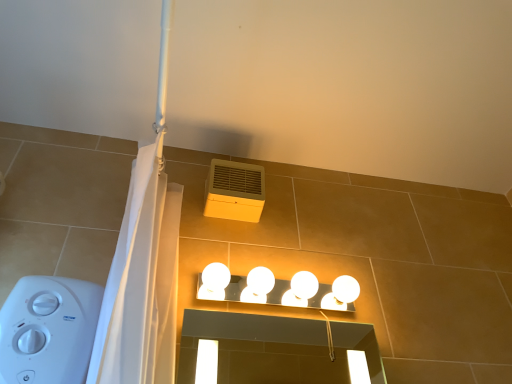
Locate an element on the screen. The height and width of the screenshot is (384, 512). white glossy light fixture at upper center is located at coordinates (281, 289).

What do you see at coordinates (281, 289) in the screenshot? The width and height of the screenshot is (512, 384). I see `white glossy light fixture at upper center` at bounding box center [281, 289].

This screenshot has height=384, width=512. Find the location of `yellow matte air conditioning at upper center`. yellow matte air conditioning at upper center is located at coordinates (234, 191).

This screenshot has height=384, width=512. Describe the element at coordinates (234, 191) in the screenshot. I see `yellow matte air conditioning at upper center` at that location.

I want to click on white glossy light fixture at upper center, so (281, 289).

Which is more to the right, yellow matte air conditioning at upper center or white glossy light fixture at upper center?

Positioned to the right is white glossy light fixture at upper center.

In the scene shown: Is yellow matte air conditioning at upper center closer to camera compared to white glossy light fixture at upper center?

No, yellow matte air conditioning at upper center is behind white glossy light fixture at upper center.

Is point (252, 200) farther from viewer compared to point (231, 292)?

Yes, it is behind point (231, 292).

From the image's perspective, is yellow matte air conditioning at upper center positioned above or below white glossy light fixture at upper center?

Based on their image positions, yellow matte air conditioning at upper center is located above white glossy light fixture at upper center.

From a real-world perspective, is yellow matte air conditioning at upper center below white glossy light fixture at upper center?

No, from a real-world perspective, yellow matte air conditioning at upper center is not beneath white glossy light fixture at upper center.

Is yellow matte air conditioning at upper center wider than white glossy light fixture at upper center?

Incorrect, the width of yellow matte air conditioning at upper center does not surpass that of white glossy light fixture at upper center.

Who is taller, yellow matte air conditioning at upper center or white glossy light fixture at upper center?

With more height is yellow matte air conditioning at upper center.

Does yellow matte air conditioning at upper center have a larger size compared to white glossy light fixture at upper center?

Incorrect, yellow matte air conditioning at upper center is not larger than white glossy light fixture at upper center.

Is white glossy light fixture at upper center a part of yellow matte air conditioning at upper center?

Actually, white glossy light fixture at upper center is outside yellow matte air conditioning at upper center.

Is yellow matte air conditioning at upper center positioned far away from white glossy light fixture at upper center?

They are positioned close to each other.

Is yellow matte air conditioning at upper center looking in the opposite direction of white glossy light fixture at upper center?

No.

How different are the orientations of yellow matte air conditioning at upper center and white glossy light fixture at upper center in degrees?

The facing directions of yellow matte air conditioning at upper center and white glossy light fixture at upper center are 1.23 degrees apart.

Measure the distance from yellow matte air conditioning at upper center to white glossy light fixture at upper center.

yellow matte air conditioning at upper center is 28.72 centimeters away from white glossy light fixture at upper center.

This screenshot has height=384, width=512. I want to click on air conditioning located on the left of white glossy light fixture at upper center, so pyautogui.click(x=234, y=191).

Does white glossy light fixture at upper center appear on the left side of yellow matte air conditioning at upper center?

No, white glossy light fixture at upper center is not to the left of yellow matte air conditioning at upper center.

Which object is further away from the camera, white glossy light fixture at upper center or yellow matte air conditioning at upper center?

yellow matte air conditioning at upper center is behind.

Considering the points (232, 289) and (230, 206), which point is in front, point (232, 289) or point (230, 206)?

The point (232, 289) is more forward.

From the image's perspective, relative to yellow matte air conditioning at upper center, is white glossy light fixture at upper center above or below?

Based on their image positions, white glossy light fixture at upper center is located beneath yellow matte air conditioning at upper center.

From a real-world perspective, who is located lower, white glossy light fixture at upper center or yellow matte air conditioning at upper center?

white glossy light fixture at upper center, from a real-world perspective.

In terms of width, does white glossy light fixture at upper center look wider or thinner when compared to yellow matte air conditioning at upper center?

Considering their sizes, white glossy light fixture at upper center looks broader than yellow matte air conditioning at upper center.

Who is shorter, white glossy light fixture at upper center or yellow matte air conditioning at upper center?

With less height is white glossy light fixture at upper center.

Can you confirm if white glossy light fixture at upper center is bigger than yellow matte air conditioning at upper center?

Indeed, white glossy light fixture at upper center has a larger size compared to yellow matte air conditioning at upper center.

Would you say white glossy light fixture at upper center contains yellow matte air conditioning at upper center?

No, yellow matte air conditioning at upper center is not a part of white glossy light fixture at upper center.

Is there a large distance between white glossy light fixture at upper center and yellow matte air conditioning at upper center?

No.

Could you tell me if white glossy light fixture at upper center is turned towards yellow matte air conditioning at upper center?

No, white glossy light fixture at upper center is not aimed at yellow matte air conditioning at upper center.

Where is `air conditioning above the white glossy light fixture at upper center (from the image's perspective)`? The width and height of the screenshot is (512, 384). air conditioning above the white glossy light fixture at upper center (from the image's perspective) is located at coordinates (234, 191).

Locate an element on the screen. Image resolution: width=512 pixels, height=384 pixels. air conditioning on the left of the white glossy light fixture at upper center is located at coordinates (234, 191).

In the image, there is a white glossy light fixture at upper center. Identify the location of air conditioning above it (from the image's perspective). (234, 191).